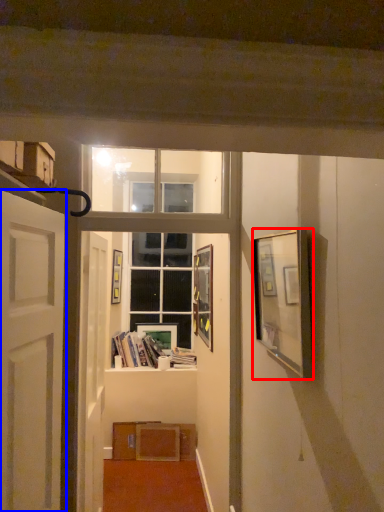
Question: Which of the following is the closest to the observer, picture frame (highlighted by a red box) or door (highlighted by a blue box)?

Choices:
 (A) picture frame
 (B) door

Answer: (B)